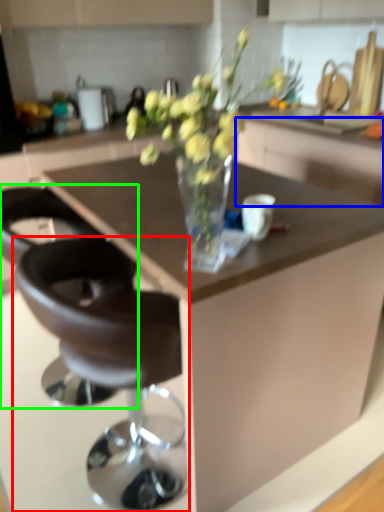
Question: Which is farther away from chair (highlighted by a red box)? cabinetry (highlighted by a blue box) or chair (highlighted by a green box)?

Choices:
 (A) cabinetry
 (B) chair

Answer: (A)